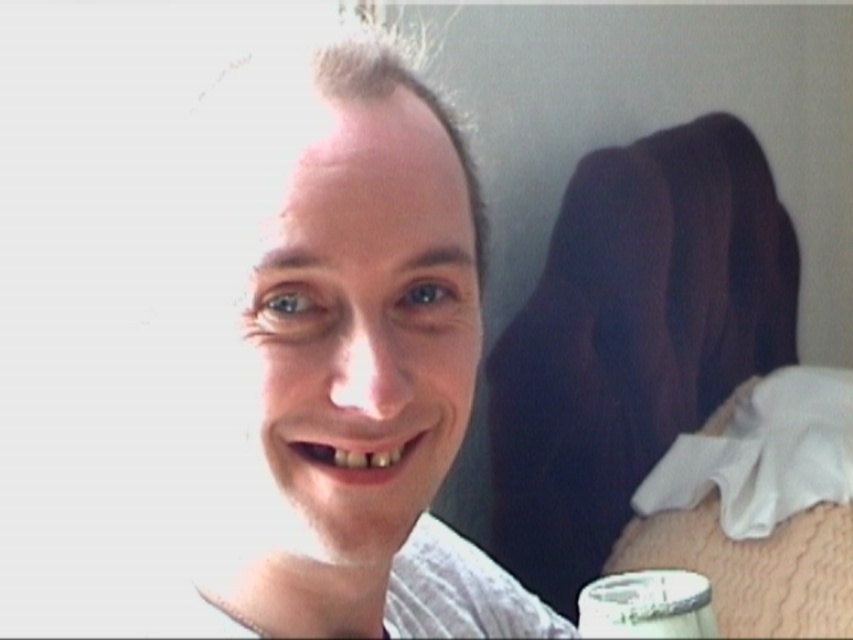
Who is lower down, white textured shirt at center or metallic silver cup at lower right?

Positioned lower is metallic silver cup at lower right.

Is point (367, 502) behind point (637, 596)?

No, (367, 502) is closer to viewer.

Which is in front, point (293, 214) or point (675, 632)?

Point (293, 214)

The width and height of the screenshot is (853, 640). Identify the location of white textured shirt at center. (352, 355).